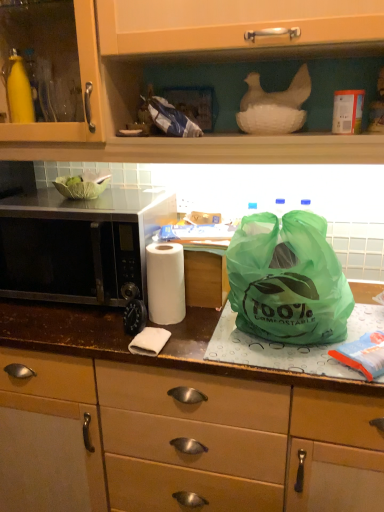
Where is `spots to the right of white matte paper towel at center`? spots to the right of white matte paper towel at center is located at coordinates (216, 334).